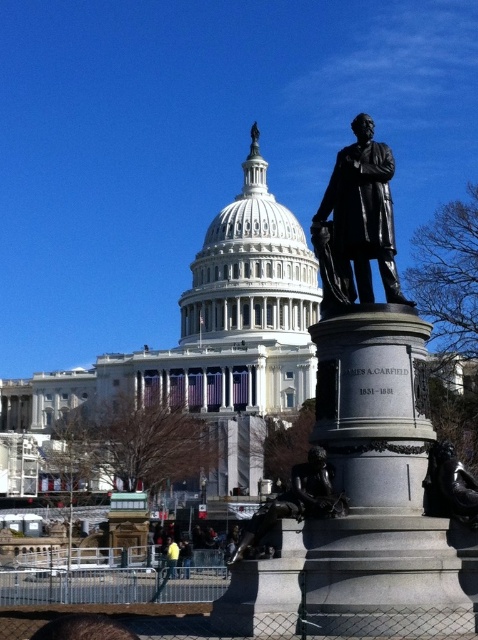
You are a tour guide leading a group to the United States Capitol. You notice two bronze statues, the bronze statue at right and the bronze statue at center. Your group wants to take a photo that includes both statues in the frame. Based on their distance apart, can you estimate whether a standard smartphone camera can capture both statues in a single photo without moving the phone?

The bronze statue at right and bronze statue at center are 43.79 feet apart from each other. A standard smartphone camera has a field of view that can typically capture about 50 feet at a moderate zoom level. Since the distance between them is less than 50 feet, it is possible to include both statues in a single photo without moving the phone.

You are a photographer standing at the center of the scene. You want to take a photo that includes both the bronze statue at right and the yellow fabric at lower center. Which object should you position closer to the edge of the frame to ensure both are fully visible?

To ensure both the bronze statue at right and the yellow fabric at lower center are fully visible, position the bronze statue at right closer to the edge of the frame since it might be wider than the yellow fabric at lower center.